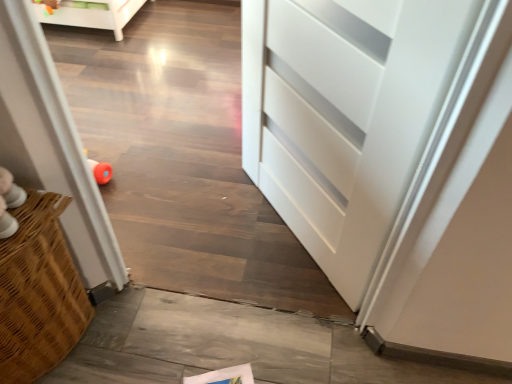
Question: Is white glossy screen door at left bigger or smaller than multicolored plastic toy at upper left?

Choices:
 (A) small
 (B) big

Answer: (B)

Question: Is white glossy screen door at left inside the boundaries of multicolored plastic toy at upper left, or outside?

Choices:
 (A) inside
 (B) outside

Answer: (B)

Question: From a real-world perspective, is white glossy screen door at left above or below multicolored plastic toy at upper left?

Choices:
 (A) below
 (B) above

Answer: (B)

Question: In the image, is multicolored plastic toy at upper left positioned in front of or behind white glossy screen door at left?

Choices:
 (A) front
 (B) behind

Answer: (B)

Question: Is multicolored plastic toy at upper left inside or outside of white glossy screen door at left?

Choices:
 (A) outside
 (B) inside

Answer: (A)

Question: Considering the relative positions of multicolored plastic toy at upper left and white glossy screen door at left in the image provided, is multicolored plastic toy at upper left to the left or to the right of white glossy screen door at left?

Choices:
 (A) left
 (B) right

Answer: (A)

Question: Is multicolored plastic toy at upper left bigger or smaller than white glossy screen door at left?

Choices:
 (A) small
 (B) big

Answer: (A)